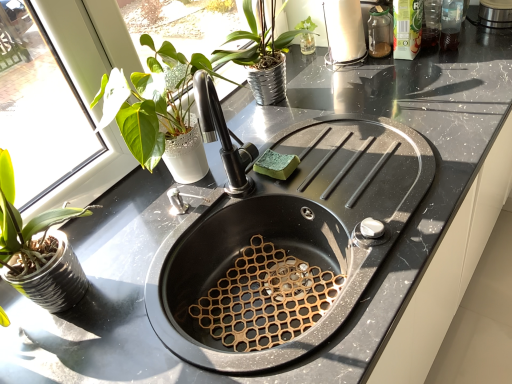
Locate an element on the screen. The image size is (512, 384). free space in front of white glossy paper towel holder at upper right is located at coordinates (358, 84).